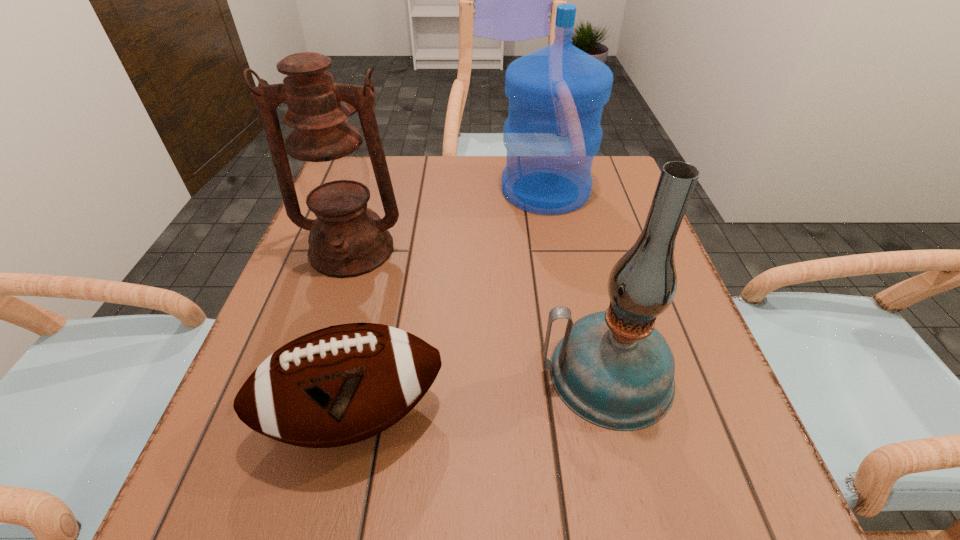
I want to click on free point between the farthest object and the farther oil lamp, so click(448, 220).

Where is `object that is the third closest one to the shortest object`? object that is the third closest one to the shortest object is located at coordinates (556, 94).

At what (x,y) coordinates should I click in order to perform the action: click on the third closest object relative to the shortest object. Please return your answer as a coordinate pair (x, y). This screenshot has height=540, width=960. Looking at the image, I should click on point(556,94).

Identify the location of vacant space that satisfies the following two spatial constraints: 1. on the front side of the farthest object; 2. on the left side of the right oil lamp. This screenshot has height=540, width=960. (581, 374).

This screenshot has width=960, height=540. I want to click on blank space that satisfies the following two spatial constraints: 1. on the front side of the farthest object; 2. on the left side of the nearer oil lamp, so click(581, 374).

Locate an element on the screen. blank area in the image that satisfies the following two spatial constraints: 1. on the back side of the water jug; 2. on the right side of the third nearest object is located at coordinates (372, 190).

Identify the location of free location that satisfies the following two spatial constraints: 1. on the back side of the farthest object; 2. on the right side of the shortest object. The image size is (960, 540). (404, 190).